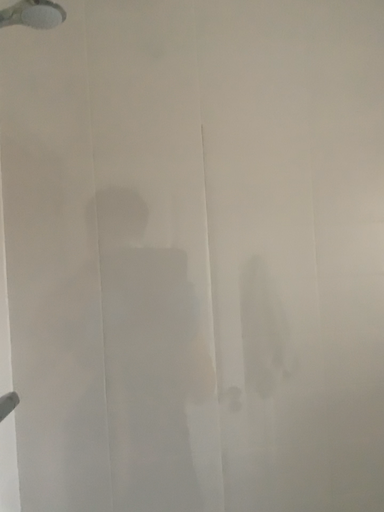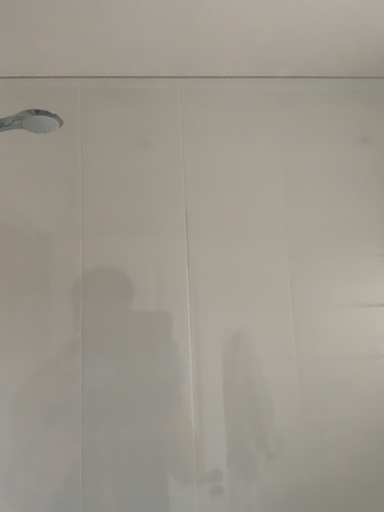
Question: How did the camera likely rotate when shooting the video?

Choices:
 (A) rotated upward
 (B) rotated downward

Answer: (A)